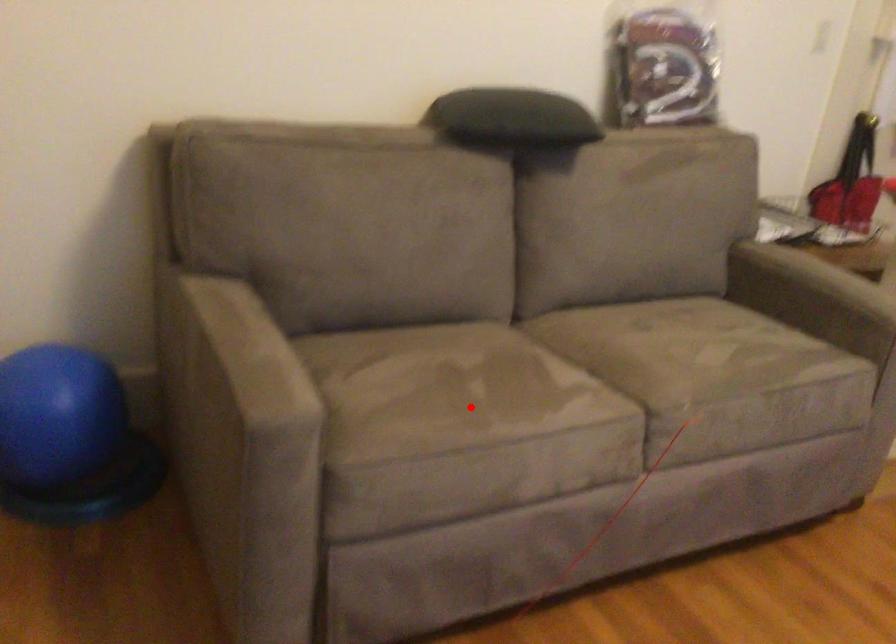
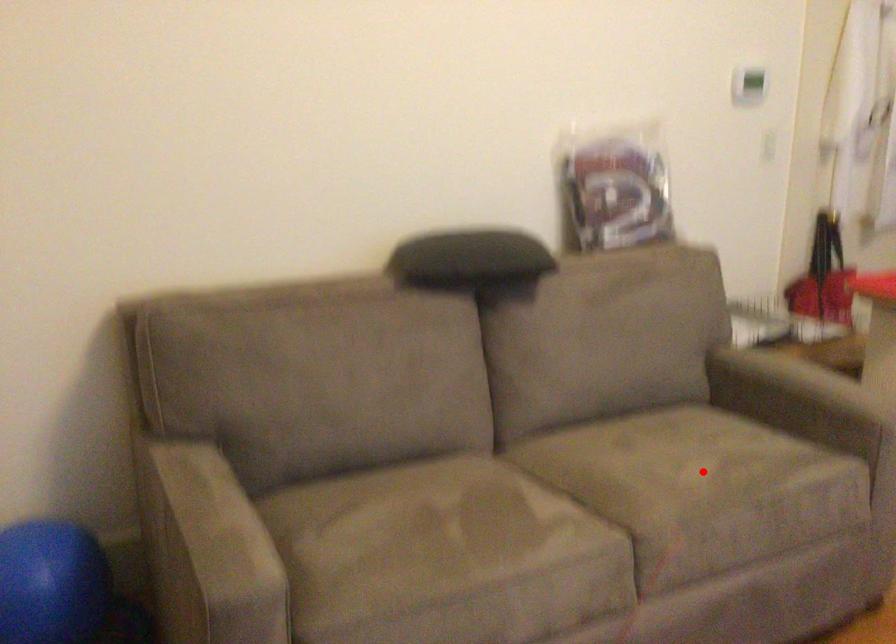
I am providing you with two images of the same scene from different viewpoints. A red point is marked on the first image and another point is marked on the second image. Does the point marked in image1 correspond to the same location as the one in image2?

No